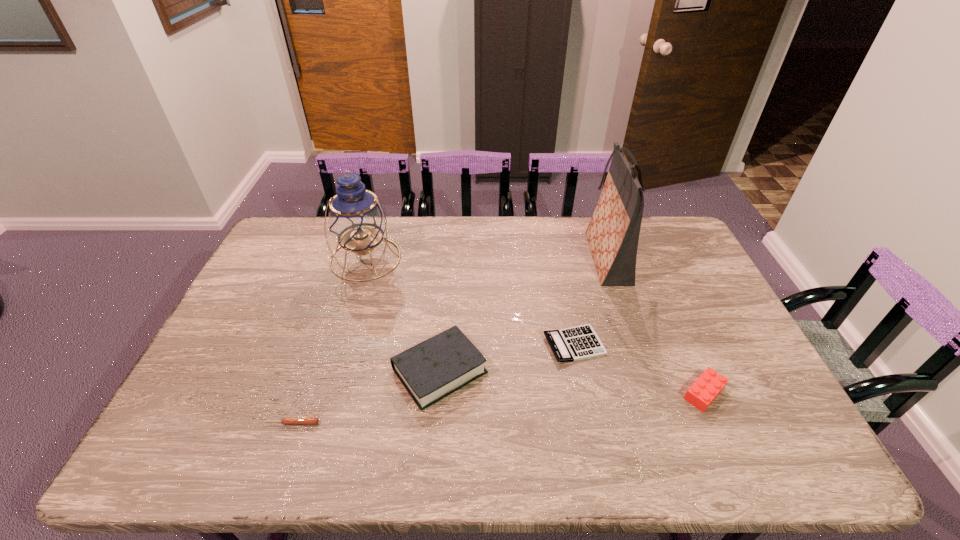
The height and width of the screenshot is (540, 960). In order to click on shopping bag in this screenshot , I will do `click(613, 233)`.

Identify the location of lantern. The width and height of the screenshot is (960, 540). (357, 220).

Locate an element on the screen. the third object from left to right is located at coordinates (435, 368).

Where is `Bible`? This screenshot has width=960, height=540. Bible is located at coordinates (435, 368).

Find the location of a particular element. Lego is located at coordinates (706, 388).

This screenshot has width=960, height=540. What are the coordinates of `the fourth object from left to right` in the screenshot? It's located at (576, 343).

In order to click on sausage in this screenshot , I will do `click(287, 420)`.

I want to click on vacant space situated on the front-facing side of the shopping bag, so (526, 258).

Identify the location of vacant position located on the front-facing side of the shopping bag. (529, 258).

The image size is (960, 540). In order to click on free space located 0.180m on the front-facing side of the shopping bag in this screenshot , I will do `click(532, 258)`.